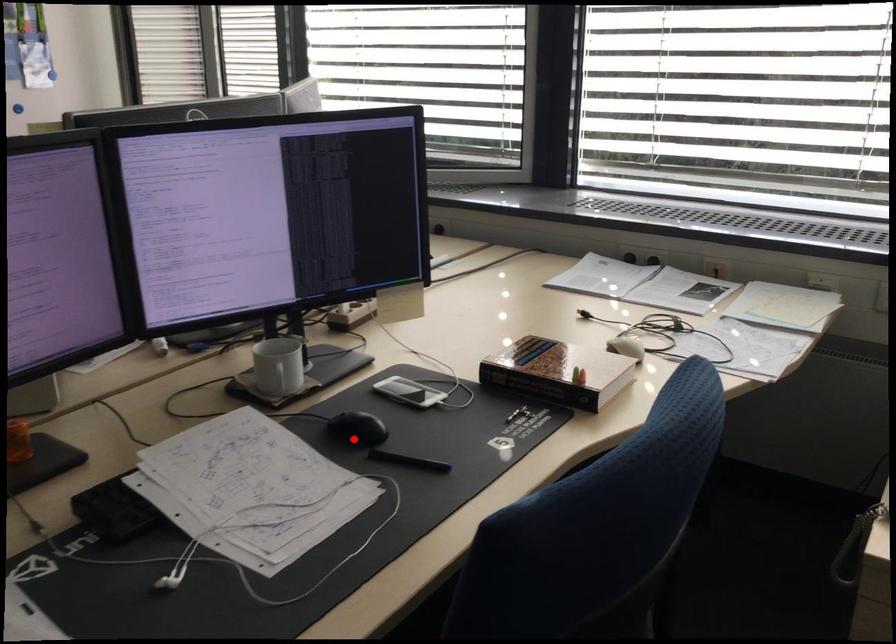
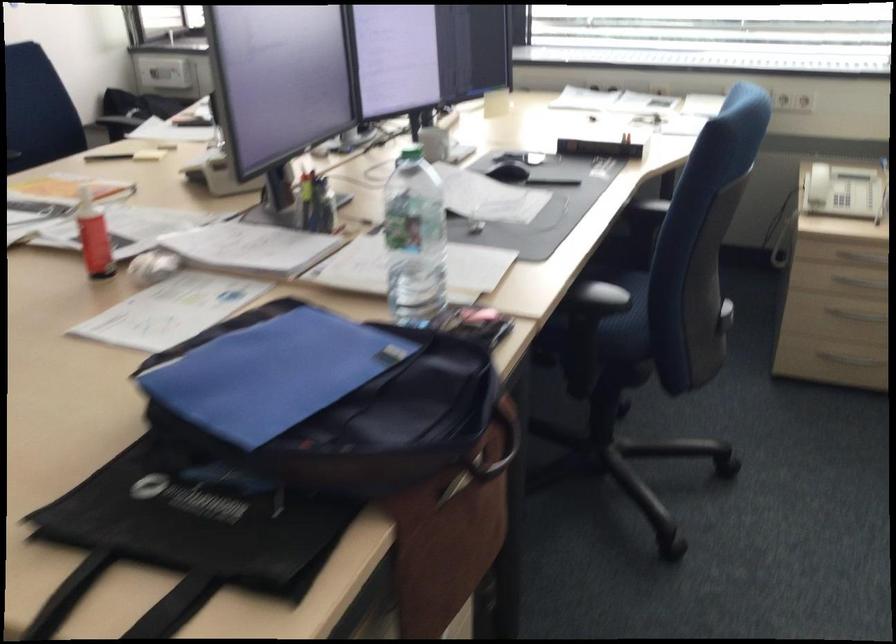
In the second image, find the point that corresponds to the highlighted location in the first image.

(509, 172)